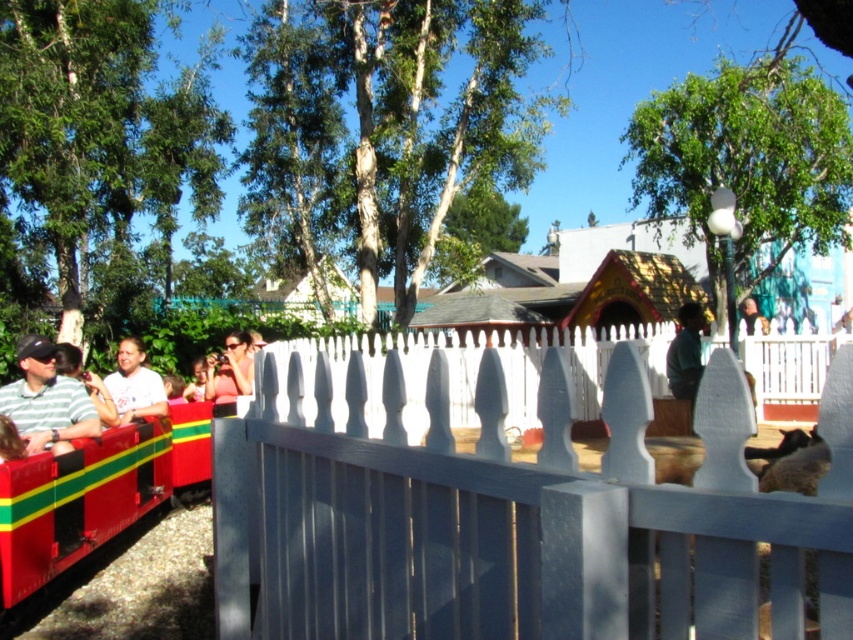
You are a photographer trying to capture a clear shot of the striped green and white shirt at left and the smooth skin face at upper center in the theme park scene. Based on their sizes in the image, which object would you focus on first to ensure it is in sharp focus?

The striped green and white shirt at left occupies less space than the smooth skin face at upper center, so you should focus on the striped green and white shirt at left first to ensure it is in sharp focus since smaller objects require precise focusing.

You are standing at the entrance of the theme park and see a person wearing a dark green shirt at center. Can you determine the exact coordinates of where this person is located in the image?

The dark green shirt at center is located at point (685, 353).